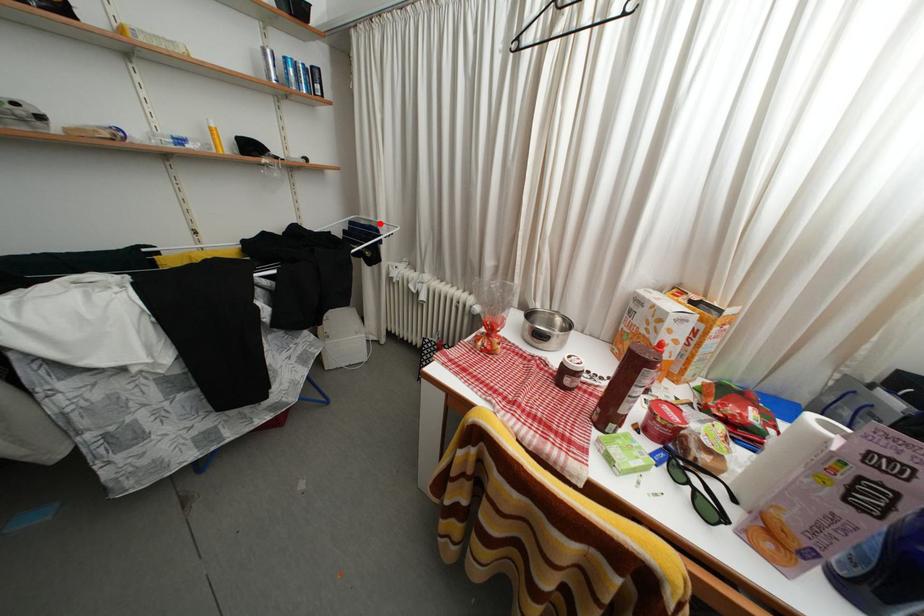
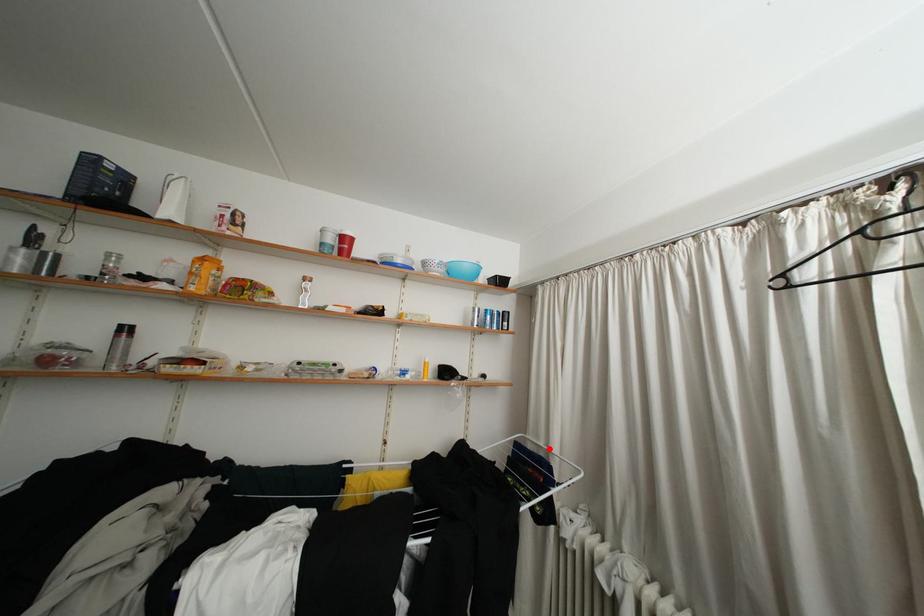
I am providing you with two images of the same scene from different viewpoints. A red point is marked on the first image and another point is marked on the second image. Does the point marked in image1 correspond to the same location as the one in image2?

Yes